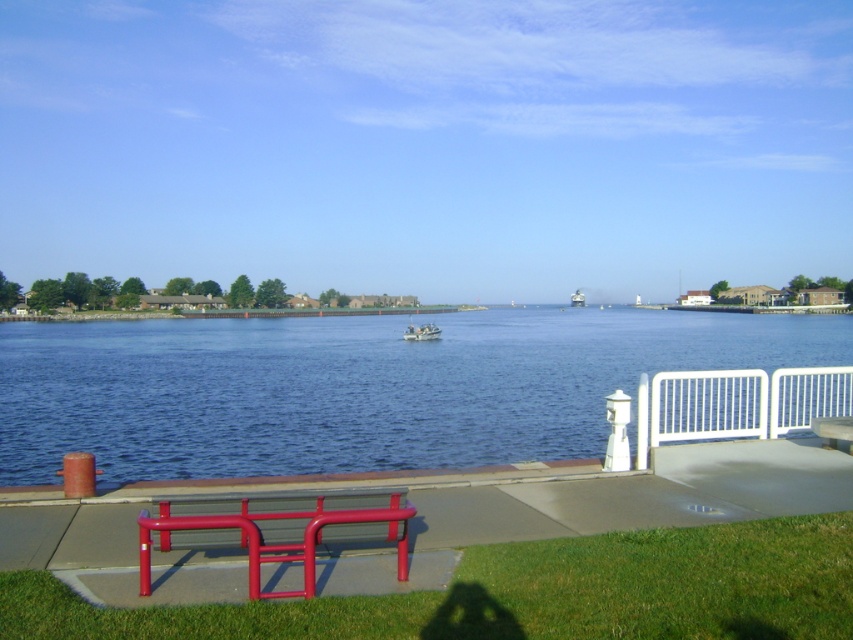
Question: Estimate the real-world distances between objects in this image. Which object is closer to the white metal fence at right?

Choices:
 (A) blue water at center
 (B) metallic gray boat at center

Answer: (A)

Question: Which object is farther from the camera taking this photo?

Choices:
 (A) blue water at center
 (B) metallic red bench at lower left
 (C) metallic gray boat at center

Answer: (C)

Question: Does white metal fence at right lie in front of metallic gray boat at center?

Choices:
 (A) yes
 (B) no

Answer: (A)

Question: Is metallic red bench at lower left smaller than metallic gray boat at center?

Choices:
 (A) yes
 (B) no

Answer: (A)

Question: Which point appears farthest from the camera in this image?

Choices:
 (A) (593, 324)
 (B) (576, 292)
 (C) (733, 404)

Answer: (B)

Question: Does blue water at center lie behind metallic gray boat at center?

Choices:
 (A) no
 (B) yes

Answer: (A)